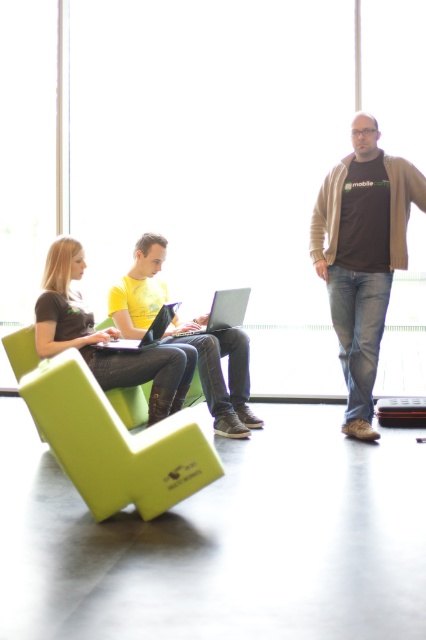
Who is positioned more to the left, green foam armchair at lower left or silver metallic laptop at center?

From the viewer's perspective, green foam armchair at lower left appears more on the left side.

Can you confirm if green foam armchair at lower left is taller than silver metallic laptop at center?

Yes.

Find the location of a particular element. Image resolution: width=426 pixels, height=640 pixels. green foam armchair at lower left is located at coordinates (109, 436).

Does green foam armchair at lower left have a greater height compared to brown cotton t-shirt at right?

No.

Does point (34, 362) lie behind point (359, 317)?

That is False.

The width and height of the screenshot is (426, 640). Find the location of `green foam armchair at lower left`. green foam armchair at lower left is located at coordinates (109, 436).

Is brown cotton t-shirt at right thinner than matte black laptop at left?

Yes, brown cotton t-shirt at right is thinner than matte black laptop at left.

The image size is (426, 640). What do you see at coordinates (362, 256) in the screenshot? I see `brown cotton t-shirt at right` at bounding box center [362, 256].

I want to click on brown cotton t-shirt at right, so click(362, 256).